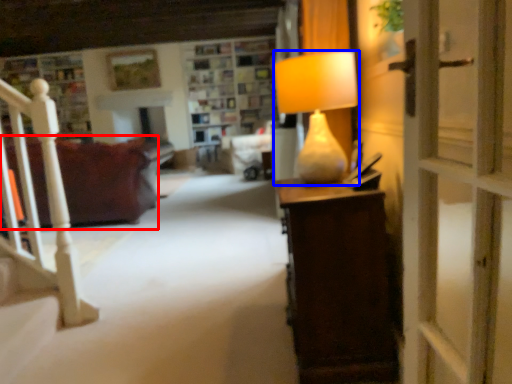
Question: Which of the following is the farthest to the observer, studio couch (highlighted by a red box) or lamp (highlighted by a blue box)?

Choices:
 (A) studio couch
 (B) lamp

Answer: (A)